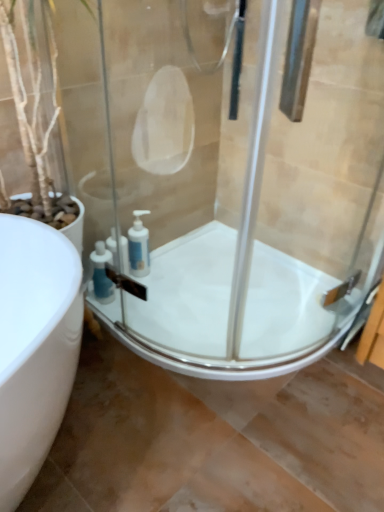
The image size is (384, 512). What do you see at coordinates (275, 213) in the screenshot? I see `transparent glass shower door at center` at bounding box center [275, 213].

What is the approximate width of white glossy soap dispenser at corner, which is counted as the first soap dispenser, starting from the right?

white glossy soap dispenser at corner, which is counted as the first soap dispenser, starting from the right, is 3.00 inches wide.

The width and height of the screenshot is (384, 512). What do you see at coordinates (139, 246) in the screenshot?
I see `white glossy soap dispenser at corner, which is counted as the first soap dispenser, starting from the right` at bounding box center [139, 246].

At what (x,y) coordinates should I click in order to perform the action: click on transparent glass shower door at center. Please return your answer as a coordinate pair (x, y). Looking at the image, I should click on (275, 213).

In terms of size, does white glossy soap dispenser at corner, which is counted as the first soap dispenser, starting from the right, appear bigger or smaller than blue plastic soap dispenser at lower center, the 2th soap dispenser when ordered from right to left?

white glossy soap dispenser at corner, which is counted as the first soap dispenser, starting from the right, is smaller than blue plastic soap dispenser at lower center, the 2th soap dispenser when ordered from right to left.

Could blue plastic soap dispenser at lower center, the 2th soap dispenser when ordered from right to left, be considered to be inside white glossy soap dispenser at corner, which is counted as the first soap dispenser, starting from the right?

No.

How much distance is there between white glossy soap dispenser at corner, arranged as the second soap dispenser when viewed from the left, and blue plastic soap dispenser at lower center, the 2th soap dispenser when ordered from right to left?

white glossy soap dispenser at corner, arranged as the second soap dispenser when viewed from the left, is 5.92 inches away from blue plastic soap dispenser at lower center, the 2th soap dispenser when ordered from right to left.

Is point (147, 252) farther from viewer compared to point (110, 286)?

Yes, point (147, 252) is farther from viewer.

Measure the distance between white glossy bath at center and transparent glass shower door at center.

white glossy bath at center is 14.40 centimeters from transparent glass shower door at center.

Is white glossy bath at center located outside transparent glass shower door at center?

Yes, white glossy bath at center is not within transparent glass shower door at center.

Who is taller, white glossy bath at center or transparent glass shower door at center?

Standing taller between the two is transparent glass shower door at center.

Can white glossy bath at center be found inside white glossy soap dispenser at corner, arranged as the second soap dispenser when viewed from the left?

No.

Which of these two, white glossy soap dispenser at corner, which is counted as the first soap dispenser, starting from the right, or white glossy bath at center, is wider?

white glossy bath at center is wider.

In the image, is white glossy soap dispenser at corner, which is counted as the first soap dispenser, starting from the right, on the left side or the right side of white glossy bath at center?

In the image, white glossy soap dispenser at corner, which is counted as the first soap dispenser, starting from the right, appears on the left side of white glossy bath at center.

Which object is more forward, blue plastic soap dispenser at lower center, the 1th soap dispenser in the left-to-right sequence, or white glossy soap dispenser at corner, arranged as the second soap dispenser when viewed from the left?

blue plastic soap dispenser at lower center, the 1th soap dispenser in the left-to-right sequence, is closer to the camera.

Find the location of a particular element. soap dispenser that is above the blue plastic soap dispenser at lower center, the 2th soap dispenser when ordered from right to left (from the image's perspective) is located at coordinates (139, 246).

Between blue plastic soap dispenser at lower center, the 1th soap dispenser in the left-to-right sequence, and white glossy soap dispenser at corner, which is counted as the first soap dispenser, starting from the right, which one has larger width?

blue plastic soap dispenser at lower center, the 1th soap dispenser in the left-to-right sequence.

From the image's perspective, which is above, blue plastic soap dispenser at lower center, the 1th soap dispenser in the left-to-right sequence, or white glossy soap dispenser at corner, arranged as the second soap dispenser when viewed from the left?

From the image's view, white glossy soap dispenser at corner, arranged as the second soap dispenser when viewed from the left, is above.

From the image's perspective, is transparent glass shower door at center located above or below white glossy bath at center?

transparent glass shower door at center is above white glossy bath at center.

You are a GUI agent. You are given a task and a screenshot of the screen. Output one action in this format:
    pyautogui.click(x=<x>, y=<y>)
    Task: Click on the shower door that appears in front of the white glossy bath at center
    The width and height of the screenshot is (384, 512).
    Given the screenshot: What is the action you would take?
    pyautogui.click(x=275, y=213)

From a real-world perspective, is transparent glass shower door at center above or below white glossy bath at center?

transparent glass shower door at center is situated higher than white glossy bath at center in the real world.

How many degrees apart are the facing directions of transparent glass shower door at center and white glossy bath at center?

89.2 degrees separate the facing orientations of transparent glass shower door at center and white glossy bath at center.

Find the location of `the 2nd soap dispenser behind the transparent glass shower door at center, starting your count from the anchor`. the 2nd soap dispenser behind the transparent glass shower door at center, starting your count from the anchor is located at coordinates (139, 246).

Choose the correct answer: Is white glossy soap dispenser at corner, which is counted as the first soap dispenser, starting from the right, inside transparent glass shower door at center or outside it?

white glossy soap dispenser at corner, which is counted as the first soap dispenser, starting from the right, is spatially situated outside transparent glass shower door at center.

From the image's perspective, relative to transparent glass shower door at center, is white glossy soap dispenser at corner, arranged as the second soap dispenser when viewed from the left, above or below?

Clearly, from the image's perspective, white glossy soap dispenser at corner, arranged as the second soap dispenser when viewed from the left, is below transparent glass shower door at center.

From a real-world perspective, which object rests below the other?

white glossy soap dispenser at corner, arranged as the second soap dispenser when viewed from the left, is physically lower.

From the image's perspective, is white glossy bath at center above white glossy soap dispenser at corner, which is counted as the first soap dispenser, starting from the right?

No, from the image's perspective, white glossy bath at center is not on top of white glossy soap dispenser at corner, which is counted as the first soap dispenser, starting from the right.

Is white glossy soap dispenser at corner, which is counted as the first soap dispenser, starting from the right, at the back of white glossy bath at center?

No.

Is white glossy bath at center not inside white glossy soap dispenser at corner, which is counted as the first soap dispenser, starting from the right?

white glossy bath at center lies outside white glossy soap dispenser at corner, which is counted as the first soap dispenser, starting from the right,'s area.

Between white glossy bath at center and white glossy soap dispenser at corner, which is counted as the first soap dispenser, starting from the right, which one appears on the right side from the viewer's perspective?

Positioned to the right is white glossy bath at center.

Locate an element on the screen. The width and height of the screenshot is (384, 512). soap dispenser below the white glossy soap dispenser at corner, arranged as the second soap dispenser when viewed from the left (from a real-world perspective) is located at coordinates (101, 274).

The image size is (384, 512). What are the coordinates of `bath behind the transparent glass shower door at center` in the screenshot? It's located at (228, 310).

Consider the image. Which object lies nearer to the anchor point white glossy soap dispenser at corner, which is counted as the first soap dispenser, starting from the right, white glossy bath at center or blue plastic soap dispenser at lower center, the 1th soap dispenser in the left-to-right sequence?

Among the two, blue plastic soap dispenser at lower center, the 1th soap dispenser in the left-to-right sequence, is located nearer to white glossy soap dispenser at corner, which is counted as the first soap dispenser, starting from the right.

Looking at the image, which one is located further to blue plastic soap dispenser at lower center, the 1th soap dispenser in the left-to-right sequence, white glossy soap dispenser at corner, arranged as the second soap dispenser when viewed from the left, or white glossy bath at center?

The object further to blue plastic soap dispenser at lower center, the 1th soap dispenser in the left-to-right sequence, is white glossy bath at center.

When comparing their distances from blue plastic soap dispenser at lower center, the 2th soap dispenser when ordered from right to left, does transparent glass shower door at center or white glossy bath at center seem closer?

Based on the image, white glossy bath at center appears to be nearer to blue plastic soap dispenser at lower center, the 2th soap dispenser when ordered from right to left.

Based on the photo, considering their positions, is white glossy bath at center positioned further to transparent glass shower door at center than blue plastic soap dispenser at lower center, the 1th soap dispenser in the left-to-right sequence?

blue plastic soap dispenser at lower center, the 1th soap dispenser in the left-to-right sequence, is positioned further to the anchor transparent glass shower door at center.

Considering their positions, is white glossy soap dispenser at corner, which is counted as the first soap dispenser, starting from the right, positioned closer to white glossy bath at center than blue plastic soap dispenser at lower center, the 1th soap dispenser in the left-to-right sequence?

The object closer to white glossy bath at center is white glossy soap dispenser at corner, which is counted as the first soap dispenser, starting from the right.

From the image, which object appears to be nearer to blue plastic soap dispenser at lower center, the 2th soap dispenser when ordered from right to left, white glossy soap dispenser at corner, arranged as the second soap dispenser when viewed from the left, or transparent glass shower door at center?

white glossy soap dispenser at corner, arranged as the second soap dispenser when viewed from the left, is closer to blue plastic soap dispenser at lower center, the 2th soap dispenser when ordered from right to left.

Based on their spatial positions, is white glossy bath at center or transparent glass shower door at center further from blue plastic soap dispenser at lower center, the 2th soap dispenser when ordered from right to left?

transparent glass shower door at center is further to blue plastic soap dispenser at lower center, the 2th soap dispenser when ordered from right to left.

Looking at this image, based on their spatial positions, is white glossy bath at center or white glossy soap dispenser at corner, arranged as the second soap dispenser when viewed from the left, closer to blue plastic soap dispenser at lower center, the 2th soap dispenser when ordered from right to left?

The object closer to blue plastic soap dispenser at lower center, the 2th soap dispenser when ordered from right to left, is white glossy soap dispenser at corner, arranged as the second soap dispenser when viewed from the left.

Find the location of a particular element. Image resolution: width=384 pixels, height=512 pixels. bath positioned between transparent glass shower door at center and white glossy soap dispenser at corner, which is counted as the first soap dispenser, starting from the right, from near to far is located at coordinates (228, 310).

Where is `soap dispenser between transparent glass shower door at center and white glossy soap dispenser at corner, which is counted as the first soap dispenser, starting from the right, from front to back`? Image resolution: width=384 pixels, height=512 pixels. soap dispenser between transparent glass shower door at center and white glossy soap dispenser at corner, which is counted as the first soap dispenser, starting from the right, from front to back is located at coordinates (101, 274).

The image size is (384, 512). Identify the location of bath positioned between transparent glass shower door at center and blue plastic soap dispenser at lower center, the 1th soap dispenser in the left-to-right sequence, from near to far. (228, 310).

Locate an element on the screen. This screenshot has height=512, width=384. soap dispenser between blue plastic soap dispenser at lower center, the 2th soap dispenser when ordered from right to left, and white glossy bath at center, in the horizontal direction is located at coordinates (139, 246).